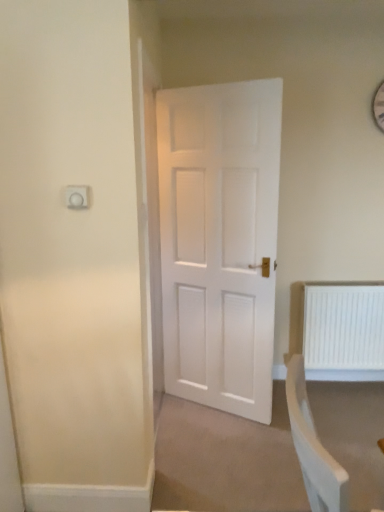
At what (x,y) coordinates should I click in order to perform the action: click on vacant area situated below white plastic radiator at lower right (from a real-world perspective). Please return your answer as a coordinate pair (x, y). The height and width of the screenshot is (512, 384). Looking at the image, I should click on (342, 383).